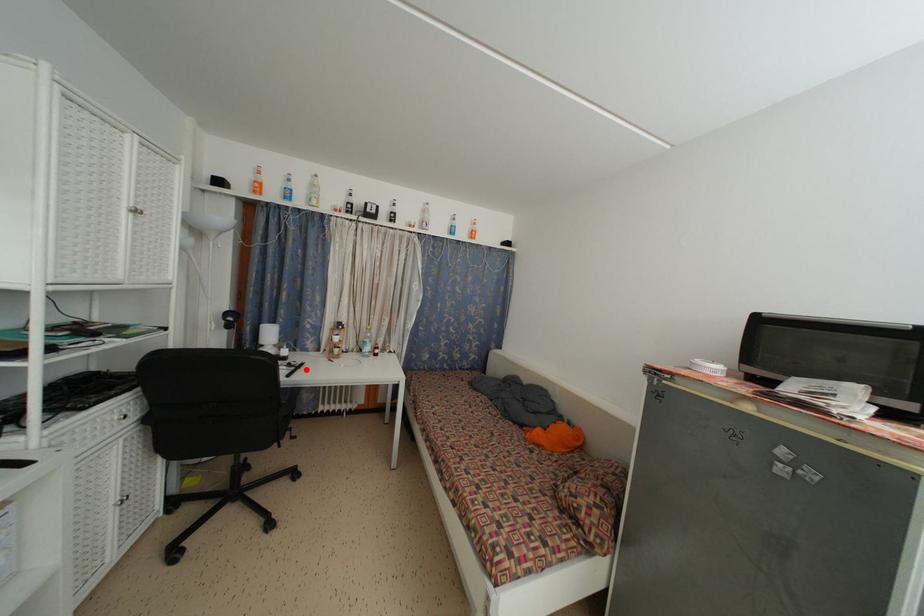
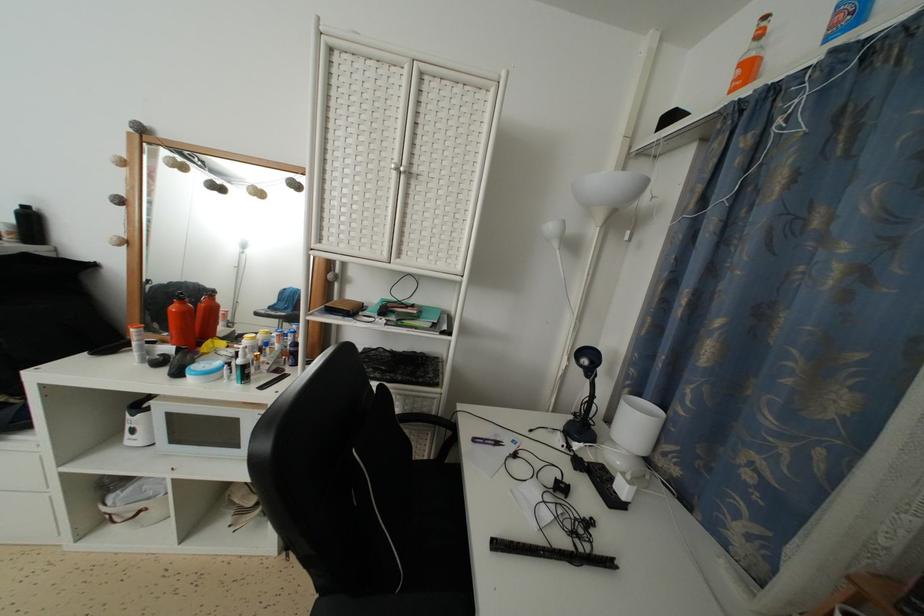
The point at the highlighted location is marked in the first image. Where is the corresponding point in the second image?

(614, 569)